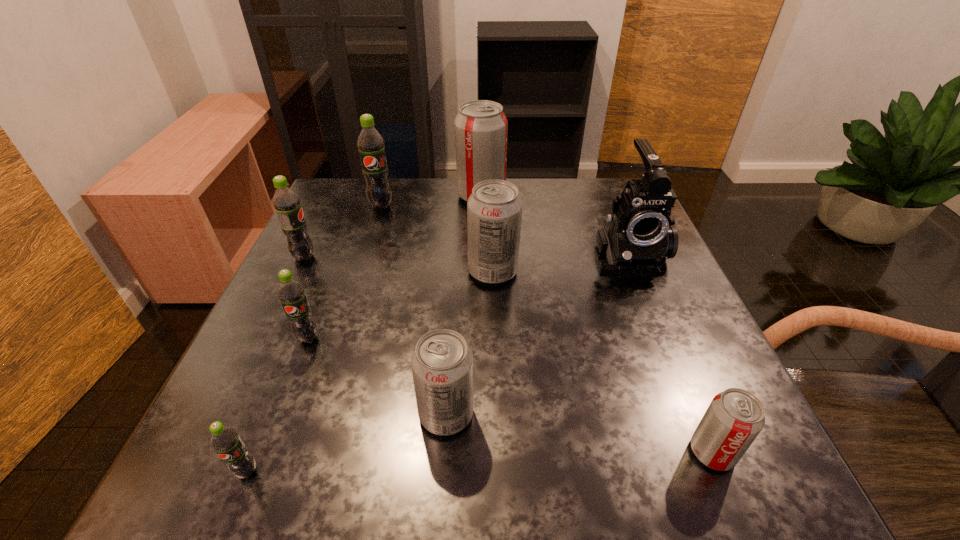
The width and height of the screenshot is (960, 540). What are the coordinates of `the nearest green soda` in the screenshot? It's located at (226, 442).

Find the location of a particular element. the rightmost gray soda can is located at coordinates (734, 418).

Where is `the rightmost soda can`? The image size is (960, 540). the rightmost soda can is located at coordinates (734, 418).

Locate an element on the screen. The width and height of the screenshot is (960, 540). vacant space located on the front of the biggest gray soda can is located at coordinates (482, 322).

Locate an element on the screen. This screenshot has width=960, height=540. vacant space located on the front label of the biggest green soda is located at coordinates (370, 241).

This screenshot has width=960, height=540. I want to click on free space located on the lens mount of the camcorder, so click(680, 387).

The image size is (960, 540). Identify the location of blank space located 0.060m on the front label of the leftmost green soda. (344, 257).

Where is `vacant space situated 0.080m on the front of the third nearest gray soda can`? vacant space situated 0.080m on the front of the third nearest gray soda can is located at coordinates (494, 317).

You are a GUI agent. You are given a task and a screenshot of the screen. Output one action in this format:
    pyautogui.click(x=<x>, y=<y>)
    Task: Click on the free space located 0.220m on the right of the second smallest gray soda can
    The height and width of the screenshot is (540, 960).
    Given the screenshot: What is the action you would take?
    pyautogui.click(x=617, y=414)

You are a GUI agent. You are given a task and a screenshot of the screen. Output one action in this format:
    pyautogui.click(x=<x>, y=<y>)
    Task: Click on the free space located on the front label of the third biggest green soda
    This screenshot has width=960, height=540.
    Given the screenshot: What is the action you would take?
    pyautogui.click(x=281, y=407)